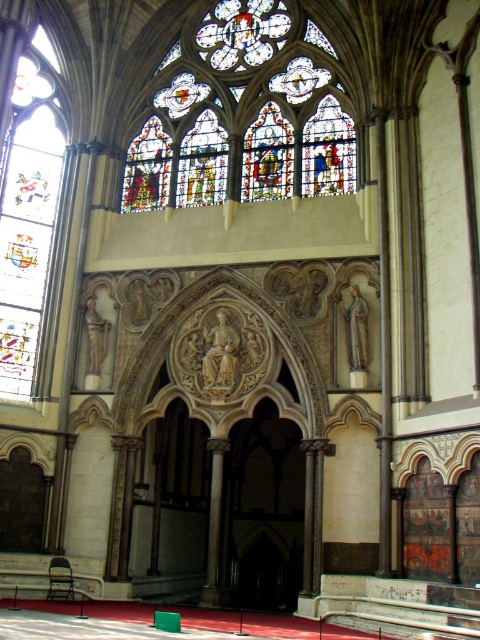
Question: Is stained glass at upper center thinner than stained glass window at left?

Choices:
 (A) no
 (B) yes

Answer: (A)

Question: Which of the following is the farthest from the observer?

Choices:
 (A) stained glass window at left
 (B) stained glass at upper center

Answer: (B)

Question: Considering the relative positions of stained glass at upper center and stained glass window at left in the image provided, where is stained glass at upper center located with respect to stained glass window at left?

Choices:
 (A) left
 (B) right

Answer: (B)

Question: Which point is farther from the camera taking this photo?

Choices:
 (A) (328, 61)
 (B) (36, 29)

Answer: (B)

Question: Is stained glass at upper center positioned at the back of stained glass window at left?

Choices:
 (A) yes
 (B) no

Answer: (A)